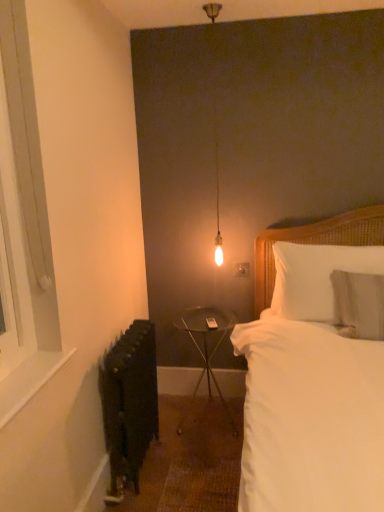
Question: Is white wood window at left inside the boundaries of metallic silver table at center, or outside?

Choices:
 (A) outside
 (B) inside

Answer: (A)

Question: From the image's perspective, is white wood window at left positioned above or below metallic silver table at center?

Choices:
 (A) above
 (B) below

Answer: (A)

Question: Which object is positioned closest to the white wood at lower left?

Choices:
 (A) white soft pillow at upper right, the 1th pillow when ordered from back to front
 (B) metallic silver table at center
 (C) black matte radiator at lower left
 (D) white soft pillow at upper right, the first pillow in the front-to-back sequence
 (E) white cotton bed at center

Answer: (C)

Question: Estimate the real-world distances between objects in this image. Which object is closer to the white cotton bed at center?

Choices:
 (A) metallic silver table at center
 (B) black matte radiator at lower left
 (C) white wood window at left
 (D) white soft pillow at upper right, the first pillow in the front-to-back sequence
 (E) white soft pillow at upper right, arranged as the 2th pillow when viewed from the front

Answer: (D)